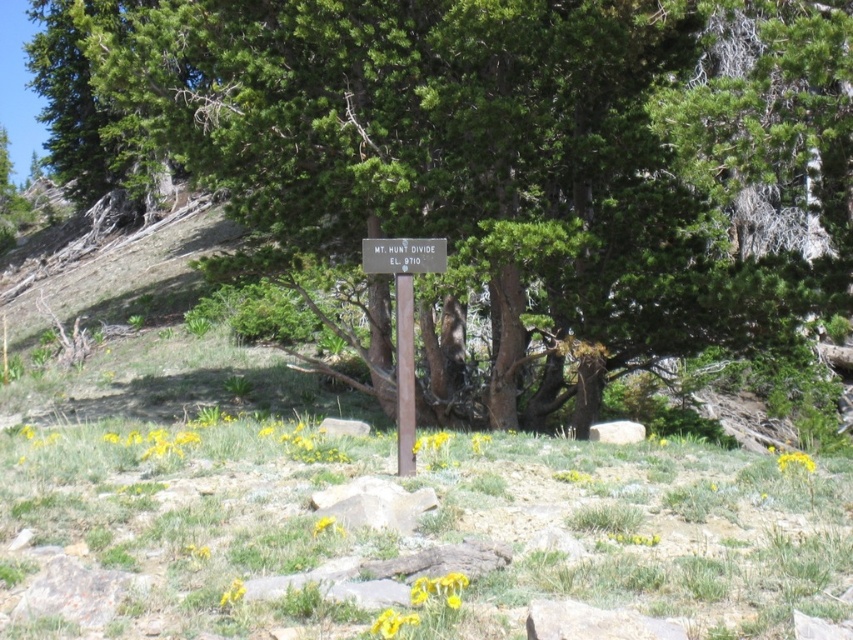
Question: Which object is farther from the camera taking this photo?

Choices:
 (A) green grassy at center
 (B) wooden sign at center
 (C) green textured tree at center

Answer: (C)

Question: Is green textured tree at center to the right of wooden sign at center from the viewer's perspective?

Choices:
 (A) no
 (B) yes

Answer: (A)

Question: Can you confirm if green grassy at center is positioned to the right of wooden sign at center?

Choices:
 (A) no
 (B) yes

Answer: (A)

Question: Which object appears closest to the camera in this image?

Choices:
 (A) wooden sign at center
 (B) green grassy at center

Answer: (B)

Question: Which of the following is the farthest from the observer?

Choices:
 (A) (585, 26)
 (B) (425, 272)

Answer: (A)

Question: Considering the relative positions of green textured tree at center and green grassy at center in the image provided, where is green textured tree at center located with respect to green grassy at center?

Choices:
 (A) right
 (B) left

Answer: (B)